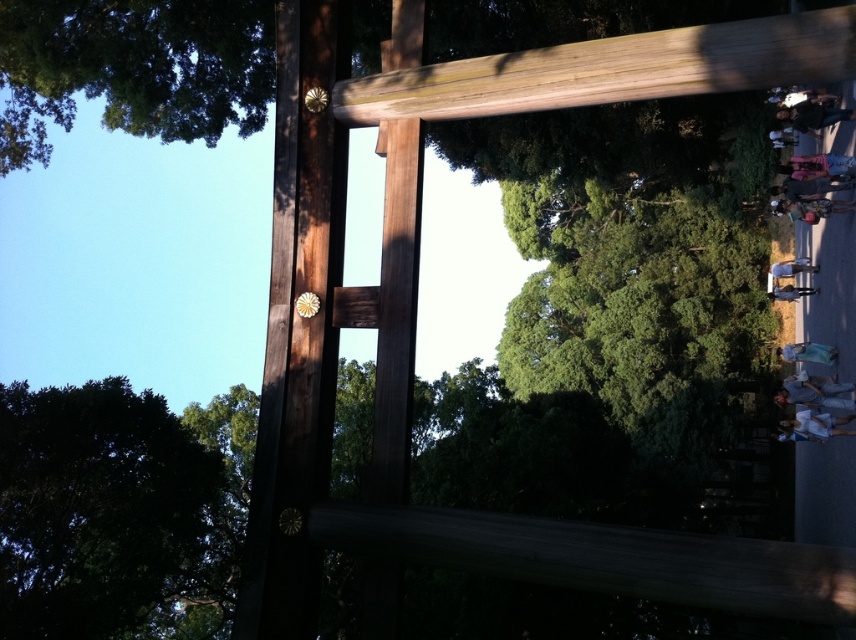
Question: Which point is farther from the camera taking this photo?

Choices:
 (A) (632, 42)
 (B) (54, 513)

Answer: (A)

Question: Is the position of green leafy tree at upper left more distant than that of light brown wood beam at upper center?

Choices:
 (A) yes
 (B) no

Answer: (A)

Question: Which of the following is the farthest from the observer?

Choices:
 (A) green leafy tree at upper left
 (B) light brown wood beam at upper center

Answer: (A)

Question: Which point appears closest to the camera in this image?

Choices:
 (A) (599, 99)
 (B) (150, 113)

Answer: (A)

Question: Is green leafy tree at upper left below dark green leafy tree at lower left?

Choices:
 (A) no
 (B) yes

Answer: (A)

Question: Observing the image, what is the correct spatial positioning of green leafy tree at upper left in reference to light brown wood beam at upper center?

Choices:
 (A) left
 (B) right

Answer: (A)